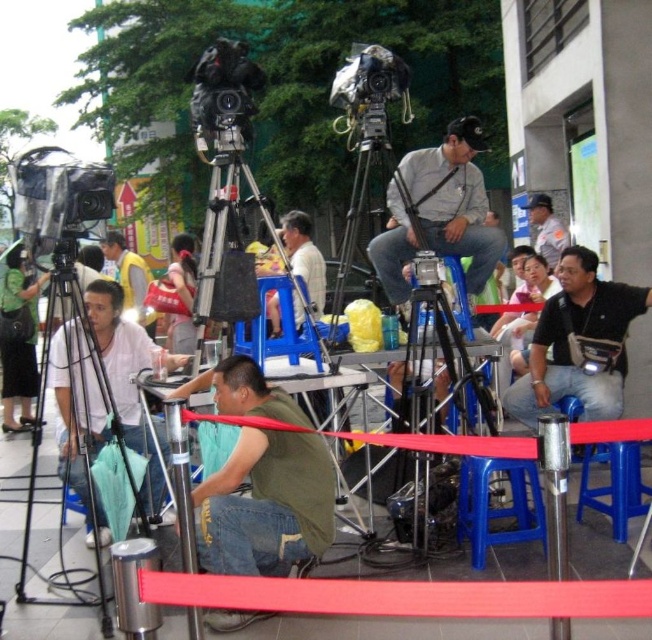
You are a photographer at the event and need to place a new camera on the black matte tripod at lower left. Considering the size of the light brown leather jacket at center nearby, will the tripod be able to support the camera without being obstructed?

The black matte tripod at lower left is larger in size than the light brown leather jacket at center, so it should have sufficient space and stability to support the camera without obstruction from the jacket.

Looking at this image, you are standing at the point labeled point (125,280) and want to walk to the point labeled point (570,264). Based on the scene description, will you need to walk towards the background or the foreground?

Point (570,264) is in front of point (125,280). Since you are at point (125,280) and want to go to the point in front, you would need to walk towards the foreground.

You are a photographer positioned at the scene. You need to capture a photo that includes both the black leather jacket at center and the light brown leather jacket at center. Given that your camera has a maximum focus range of 12 feet, will you be able to include both jackets in the same frame without moving your position?

The distance between the black leather jacket at center and the light brown leather jacket at center is 13.32 feet. Since the camera can only focus up to 12 feet, the jackets are too far apart to be captured in the same frame without moving closer or adjusting your position.